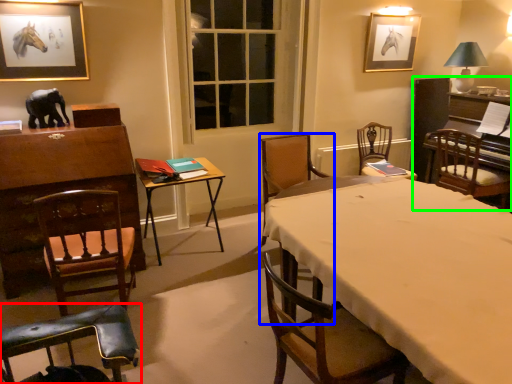
Question: Which object is positioned farthest from chair (highlighted by a red box)? Select from chair (highlighted by a blue box) and piano (highlighted by a green box).

Choices:
 (A) chair
 (B) piano

Answer: (B)